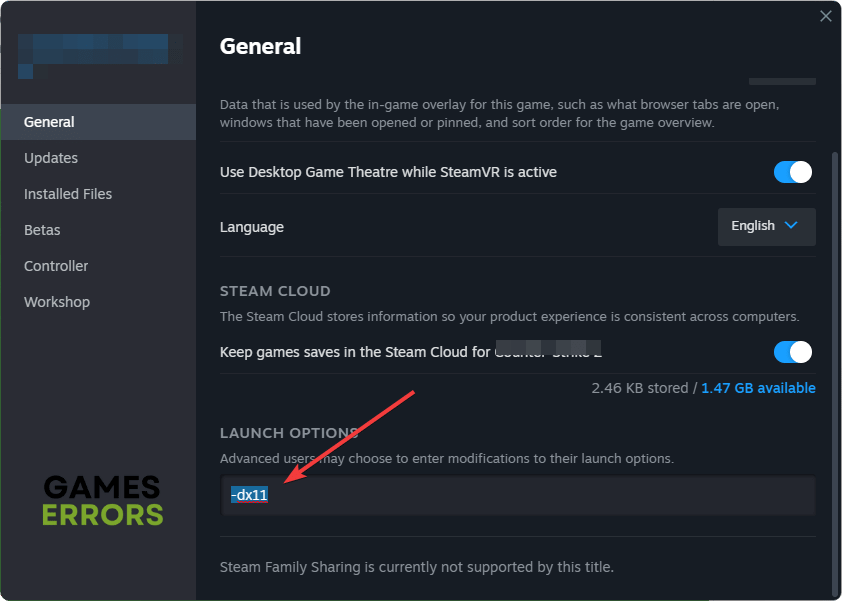
Locate an element on the screen. Image resolution: width=842 pixels, height=601 pixels. off/on button is located at coordinates (785, 166), (789, 352).